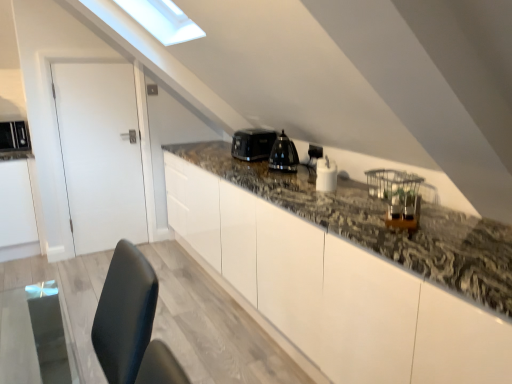
Question: From the image's perspective, is matte black microwave at left, acting as the 5th appliance starting from the front, positioned above or below granite countertop at center?

Choices:
 (A) below
 (B) above

Answer: (B)

Question: Would you say matte black microwave at left, arranged as the first appliance when viewed from the left, is inside or outside granite countertop at center?

Choices:
 (A) outside
 (B) inside

Answer: (A)

Question: Estimate the real-world distances between objects in this image. Which object is closer to the granite countertop at center?

Choices:
 (A) matte black microwave at left, arranged as the first appliance when viewed from the left
 (B) white glossy salt shaker at center, which is counted as the fourth appliance, starting from the left
 (C) black glossy kettle at center, which ranks as the 3th appliance in right-to-left order
 (D) black plastic toaster at center, the 4th appliance when ordered from right to left
 (E) black glossy kettle at upper center, positioned as the 3th appliance in back-to-front order

Answer: (B)

Question: Considering the real-world distances, which object is farthest from the white glossy salt shaker at center, the fifth appliance in the back-to-front sequence?

Choices:
 (A) matte black microwave at left, placed as the fifth appliance when sorted from right to left
 (B) white matte door at left
 (C) black glossy kettle at upper center, which is the fifth appliance in left-to-right order
 (D) black plastic toaster at center, the 4th appliance when ordered from right to left
 (E) black glossy kettle at center, positioned as the 3th appliance in left-to-right order

Answer: (A)